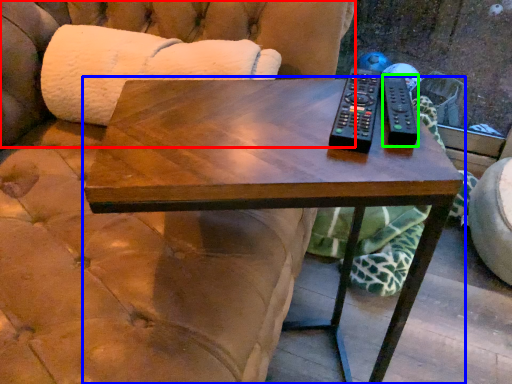
Question: Estimate the real-world distances between objects in this image. Which object is closer to couch (highlighted by a red box), coffee table (highlighted by a blue box) or remote (highlighted by a green box)?

Choices:
 (A) coffee table
 (B) remote

Answer: (A)